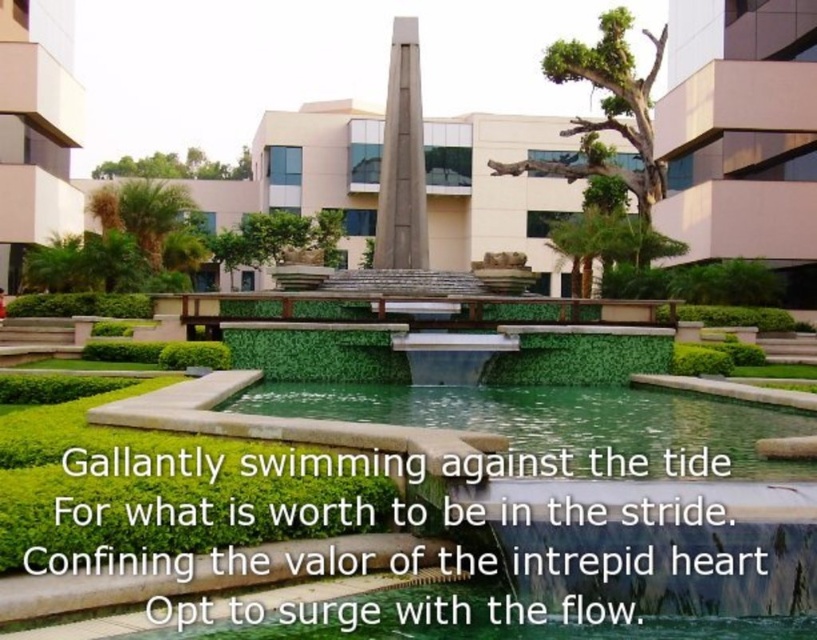
You are a landscape architect designing a new pathway around the water feature. The pathway must be exactly 20 meters away from the slate gray stone obelisk at center to ensure safety and aesthetics. Based on the current layout, will the green smooth water at center interfere with this requirement?

The green smooth water at center is currently 21.72 meters away from the slate gray stone obelisk at center. Since the required pathway distance is 20 meters, the water feature is farther away than needed, so it will not interfere with the pathway design. The pathway can be placed closer to the obelisk while maintaining the 20 meters requirement.

You are standing facing the water feature in the urban landscape. Which object, the green smooth water at center or the slate gray stone obelisk at center, is positioned to the right of the other?

The green smooth water at center is to the right of the slate gray stone obelisk at center.